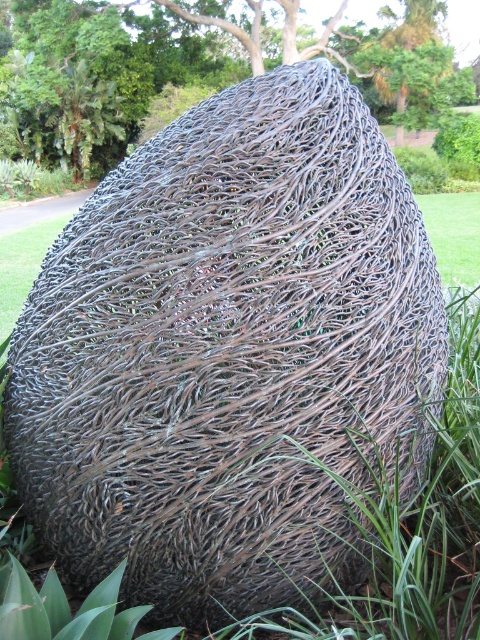
Question: Can you confirm if brown textured root at center is bigger than green grass at center?

Choices:
 (A) no
 (B) yes

Answer: (B)

Question: Among these objects, which one is nearest to the camera?

Choices:
 (A) green grass at center
 (B) brown textured root at center

Answer: (A)

Question: Which of the following is the farthest from the observer?

Choices:
 (A) green grass at center
 (B) brown textured root at center

Answer: (B)

Question: Is brown textured root at center below green grass at center?

Choices:
 (A) yes
 (B) no

Answer: (B)

Question: Does brown textured root at center appear under green grass at center?

Choices:
 (A) no
 (B) yes

Answer: (A)